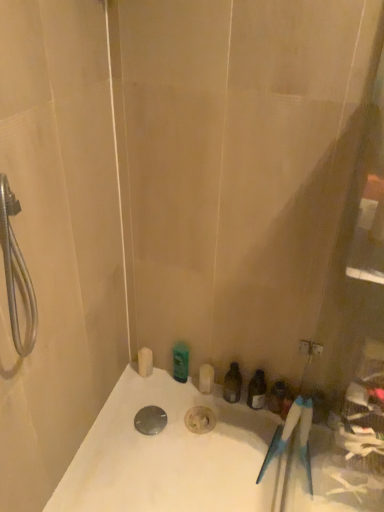
Question: Is there a large distance between matte plastic toiletries at lower right, which appears as the first toiletry when viewed from the right, and white glossy bathtub at lower center?

Choices:
 (A) no
 (B) yes

Answer: (A)

Question: Can you see matte plastic toiletries at lower right, the fourth toiletry positioned from the left, touching white glossy bathtub at lower center?

Choices:
 (A) yes
 (B) no

Answer: (B)

Question: Would you say matte plastic toiletries at lower right, the fourth toiletry positioned from the left, is outside white glossy bathtub at lower center?

Choices:
 (A) yes
 (B) no

Answer: (A)

Question: Is white glossy bathtub at lower center a part of matte plastic toiletries at lower right, which appears as the first toiletry when viewed from the right?

Choices:
 (A) yes
 (B) no

Answer: (B)

Question: Considering the relative sizes of matte plastic toiletries at lower right, which appears as the first toiletry when viewed from the right, and white glossy bathtub at lower center in the image provided, is matte plastic toiletries at lower right, which appears as the first toiletry when viewed from the right, shorter than white glossy bathtub at lower center?

Choices:
 (A) yes
 (B) no

Answer: (B)

Question: Looking at their shapes, would you say polished metallic drain at center is wider or thinner than translucent plastic bottle at center, acting as the 3th toiletry starting from the left?

Choices:
 (A) thin
 (B) wide

Answer: (B)

Question: Is polished metallic drain at center taller or shorter than translucent plastic bottle at center, which is the second toiletry in right-to-left order?

Choices:
 (A) short
 (B) tall

Answer: (A)

Question: Is point (140, 431) closer or farther from the camera than point (236, 379)?

Choices:
 (A) closer
 (B) farther

Answer: (A)

Question: From a real-world perspective, is polished metallic drain at center physically located above or below translucent plastic bottle at center, acting as the 3th toiletry starting from the left?

Choices:
 (A) below
 (B) above

Answer: (A)

Question: Is point (226, 393) closer or farther from the camera than point (271, 403)?

Choices:
 (A) closer
 (B) farther

Answer: (B)

Question: Looking at the image, does translucent plastic bottle at center, acting as the 3th toiletry starting from the left, seem bigger or smaller compared to matte plastic toiletries at lower right, the fourth toiletry positioned from the left?

Choices:
 (A) small
 (B) big

Answer: (B)

Question: Is translucent plastic bottle at center, acting as the 3th toiletry starting from the left, in front of or behind matte plastic toiletries at lower right, the fourth toiletry positioned from the left, in the image?

Choices:
 (A) behind
 (B) front

Answer: (A)

Question: From a real-world perspective, is translucent plastic bottle at center, acting as the 3th toiletry starting from the left, above or below matte plastic toiletries at lower right, which appears as the first toiletry when viewed from the right?

Choices:
 (A) above
 (B) below

Answer: (A)

Question: In terms of width, does white glossy bathtub at lower center look wider or thinner when compared to translucent plastic bottle at center, which is the second toiletry in right-to-left order?

Choices:
 (A) wide
 (B) thin

Answer: (A)

Question: From the image's perspective, is white glossy bathtub at lower center positioned above or below translucent plastic bottle at center, which is the second toiletry in right-to-left order?

Choices:
 (A) below
 (B) above

Answer: (A)